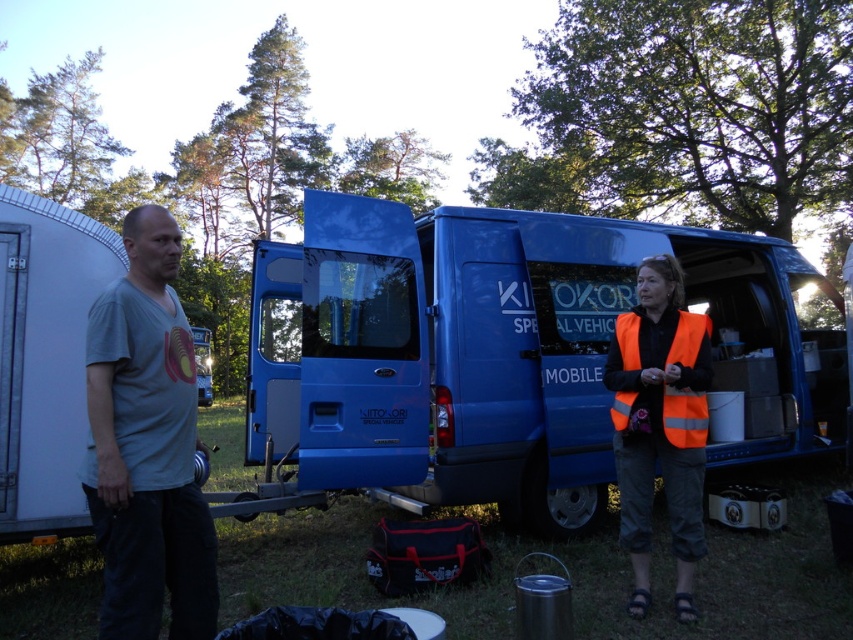
Does blue metallic van at center have a greater width compared to orange reflective vest at center?

Yes, blue metallic van at center is wider than orange reflective vest at center.

Can you confirm if blue metallic van at center is shorter than orange reflective vest at center?

Incorrect, blue metallic van at center's height does not fall short of orange reflective vest at center's.

Between point (314, 272) and point (630, 484), which one is positioned in front?

Point (630, 484)

The height and width of the screenshot is (640, 853). I want to click on blue metallic van at center, so click(509, 353).

Between gray cotton t-shirt at left and orange reflective safety vest at right, which one has more height?

With more height is gray cotton t-shirt at left.

What do you see at coordinates (148, 445) in the screenshot?
I see `gray cotton t-shirt at left` at bounding box center [148, 445].

Identify the location of gray cotton t-shirt at left. (148, 445).

Which of these two, gray cotton t-shirt at left or orange reflective vest at center, stands taller?

orange reflective vest at center is taller.

Locate an element on the screen. This screenshot has width=853, height=640. gray cotton t-shirt at left is located at coordinates (148, 445).